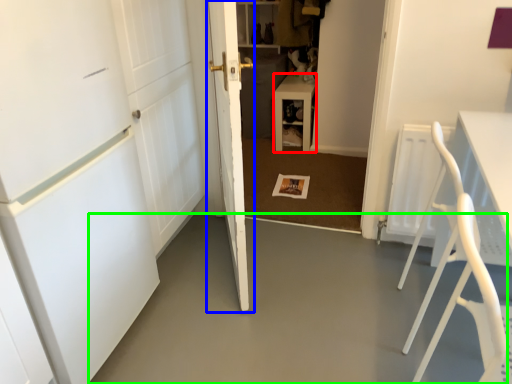
Question: Which object is positioned farthest from furniture (highlighted by a red box)? Select from door (highlighted by a blue box) and concrete (highlighted by a green box).

Choices:
 (A) door
 (B) concrete

Answer: (B)